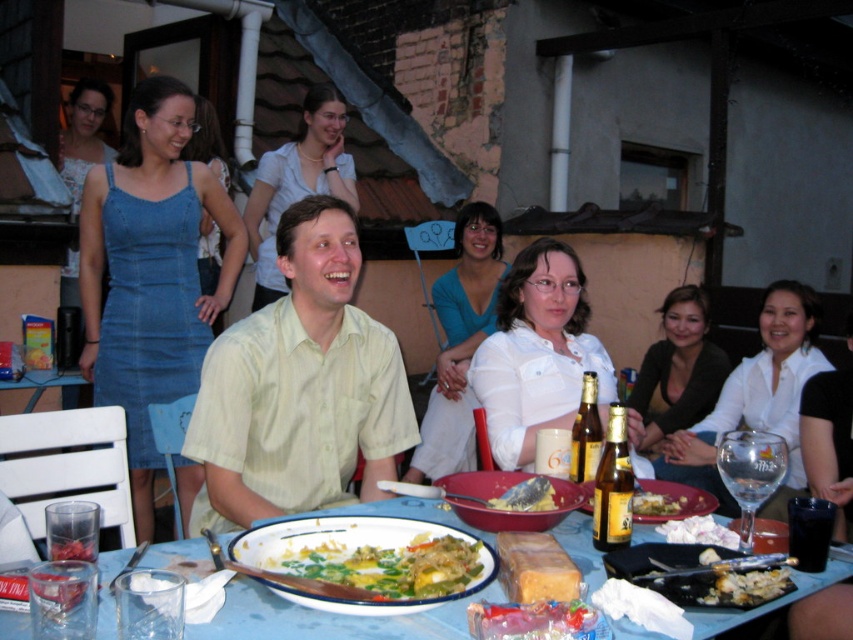
Question: Does light green shirt at center have a smaller size compared to gold glass beer bottle at center?

Choices:
 (A) yes
 (B) no

Answer: (B)

Question: Which of the following is the farthest from the observer?

Choices:
 (A) gold glass beer bottle at center
 (B) light green shirt at center
 (C) white glossy shirt at center

Answer: (C)

Question: Which object appears closest to the camera in this image?

Choices:
 (A) light green shirt at center
 (B) translucent glass bottle at table center
 (C) blue plastic table at center

Answer: (C)

Question: Can you confirm if green leafy vegetables at center is bigger than gold glass beer bottle at center?

Choices:
 (A) yes
 (B) no

Answer: (A)

Question: Can you confirm if blue plastic table at center is positioned to the right of yellowish matte fish at center?

Choices:
 (A) yes
 (B) no

Answer: (B)

Question: Among these points, which one is farthest from the camera?

Choices:
 (A) (590, 461)
 (B) (601, 518)
 (C) (346, 548)
 (D) (376, 627)

Answer: (A)